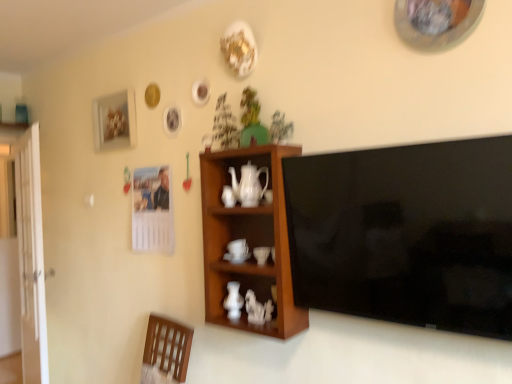
Question: Can you confirm if green matte houseplant at upper center, the 2th houseplant in the left-to-right sequence, is smaller than wooden cabinet at center?

Choices:
 (A) no
 (B) yes

Answer: (B)

Question: Is green matte houseplant at upper center, the 2th houseplant in the left-to-right sequence, to the left of wooden cabinet at center from the viewer's perspective?

Choices:
 (A) yes
 (B) no

Answer: (A)

Question: Is green matte houseplant at upper center, which is the first houseplant from right to left, taller than wooden cabinet at center?

Choices:
 (A) yes
 (B) no

Answer: (B)

Question: Does green matte houseplant at upper center, which is the first houseplant from right to left, have a greater width compared to wooden cabinet at center?

Choices:
 (A) yes
 (B) no

Answer: (B)

Question: Does green matte houseplant at upper center, the 2th houseplant in the left-to-right sequence, have a lesser width compared to wooden cabinet at center?

Choices:
 (A) yes
 (B) no

Answer: (A)

Question: Relative to white glossy teapot at center, is black glossy flat-screen tv at right in front or behind?

Choices:
 (A) front
 (B) behind

Answer: (A)

Question: Is point (343, 241) positioned closer to the camera than point (258, 201)?

Choices:
 (A) closer
 (B) farther

Answer: (A)

Question: Would you say black glossy flat-screen tv at right is to the left or to the right of white glossy teapot at center in the picture?

Choices:
 (A) right
 (B) left

Answer: (A)

Question: Is black glossy flat-screen tv at right situated inside white glossy teapot at center or outside?

Choices:
 (A) outside
 (B) inside

Answer: (A)

Question: Based on their sizes in the image, would you say white glossy vase at center is bigger or smaller than black glossy flat-screen tv at right?

Choices:
 (A) big
 (B) small

Answer: (B)

Question: From a real-world perspective, is white glossy vase at center physically located above or below black glossy flat-screen tv at right?

Choices:
 (A) below
 (B) above

Answer: (A)

Question: Is white glossy vase at center in front of or behind black glossy flat-screen tv at right in the image?

Choices:
 (A) front
 (B) behind

Answer: (B)

Question: Choose the correct answer: Is white glossy vase at center inside black glossy flat-screen tv at right or outside it?

Choices:
 (A) outside
 (B) inside

Answer: (A)

Question: Is green matte houseplant at upper center, placed as the second houseplant when sorted from right to left, in front of or behind white glossy teapot at center in the image?

Choices:
 (A) front
 (B) behind

Answer: (B)

Question: From a real-world perspective, is green matte houseplant at upper center, placed as the second houseplant when sorted from right to left, physically located above or below white glossy teapot at center?

Choices:
 (A) below
 (B) above

Answer: (B)